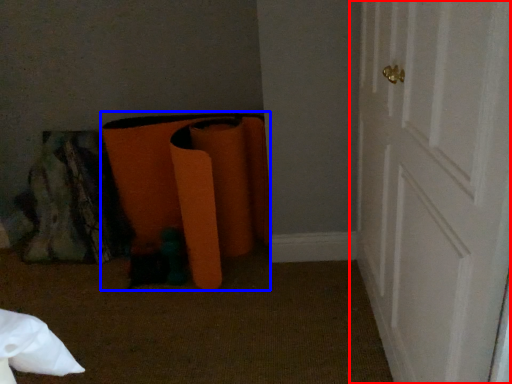
Question: Which object is closer to the camera taking this photo, door (highlighted by a red box) or bean bag chair (highlighted by a blue box)?

Choices:
 (A) door
 (B) bean bag chair

Answer: (A)